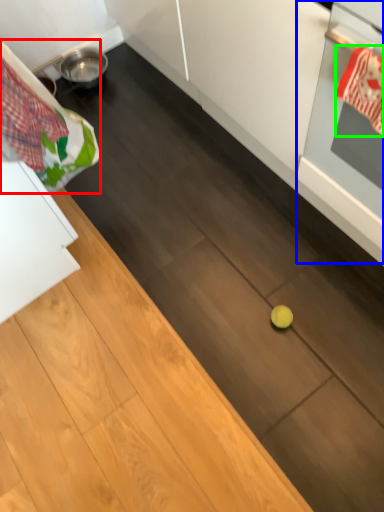
Question: Considering the real-world distances, which object is closest to laundry (highlighted by a red box)? oven (highlighted by a blue box) or material (highlighted by a green box).

Choices:
 (A) oven
 (B) material

Answer: (A)